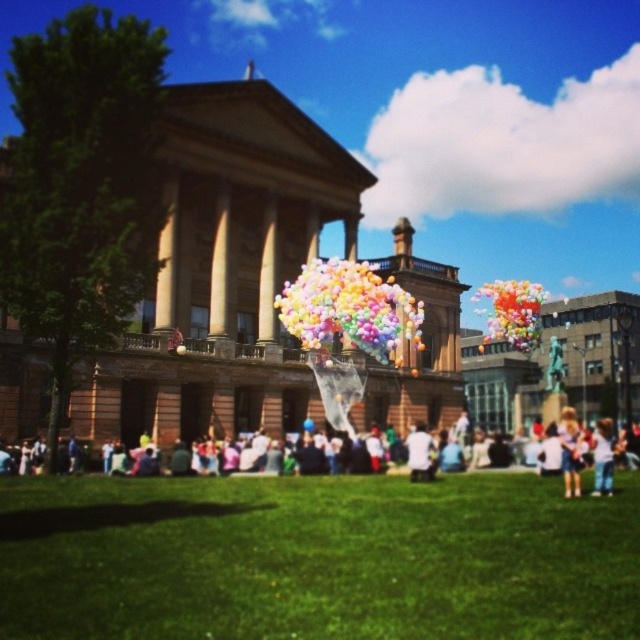
From the picture: You are standing at the origin point of the coordinate system. You want to walk to the green grass at center. What are the coordinates you need to move to?

The coordinates of the green grass at center are at point (x=316, y=557). So you need to move to coordinates (x=316, y=557).

You are a photographer standing in front of the classical building. You want to take a photo of the white cotton shirt at center without the pastel balloons at upper center appearing in the frame. Is this possible?

The white cotton shirt at center is behind the pastel balloons at upper center, so it is not possible to take a photo of the white cotton shirt at center without the pastel balloons at upper center appearing in the frame.